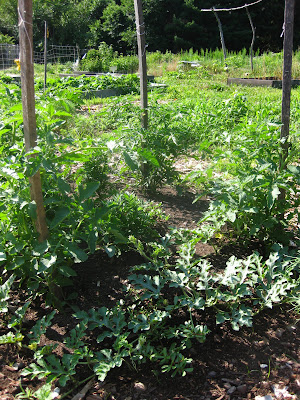
The width and height of the screenshot is (300, 400). Identify the location of wooded box. (264, 81).